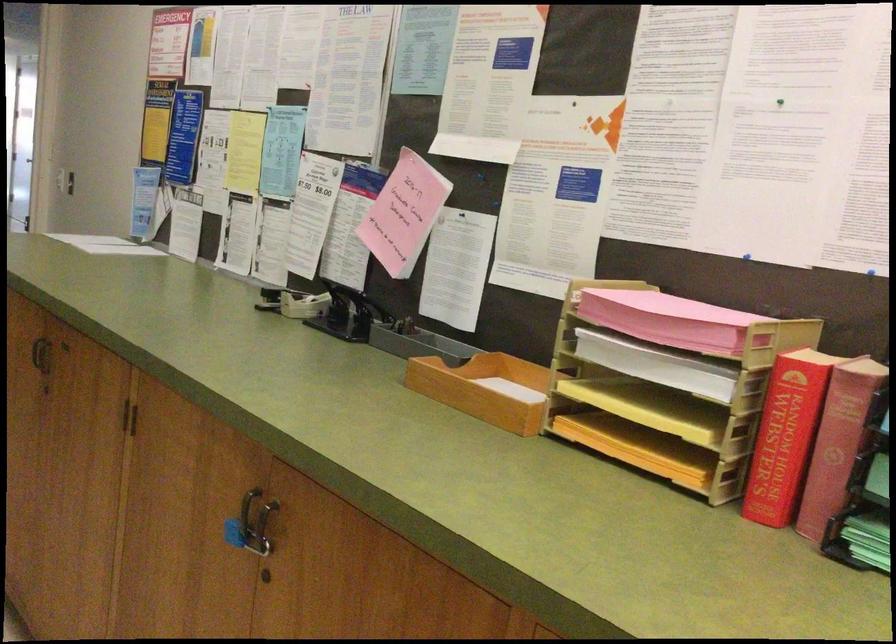
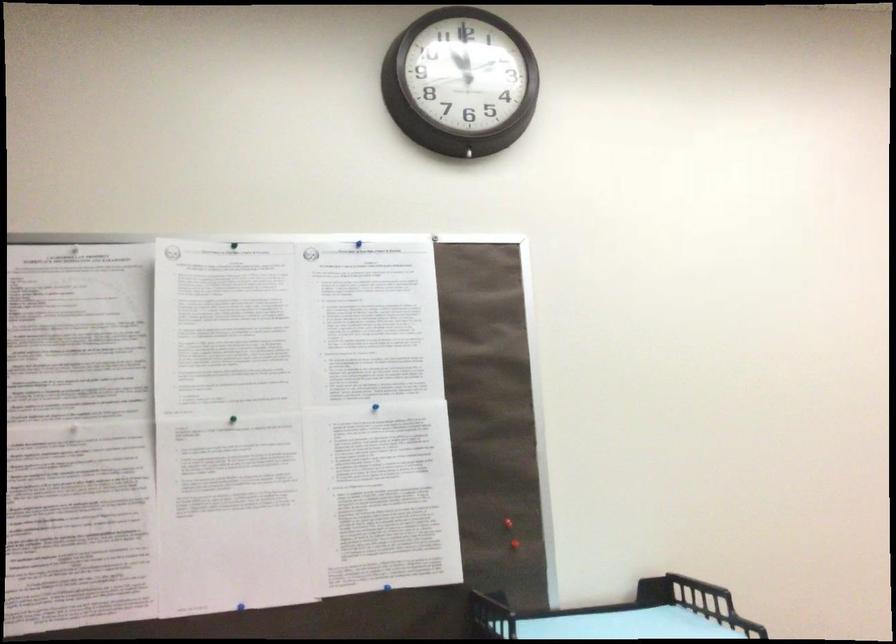
Question: Based on the continuous images, in which direction is the camera rotating? Reply with the corresponding letter.

Choices:
 (A) Left
 (B) Right
 (C) Up
 (D) Down

Answer: (B)